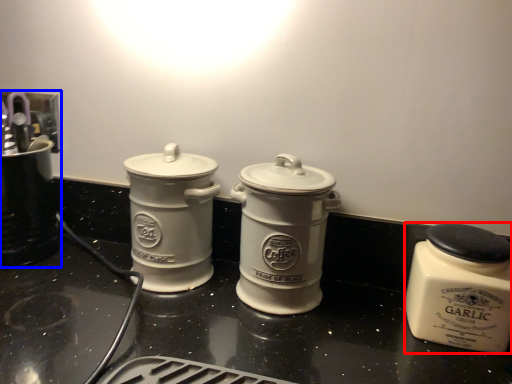
Question: Which object is closer to the camera taking this photo, kitchen appliance (highlighted by a red box) or appliance (highlighted by a blue box)?

Choices:
 (A) kitchen appliance
 (B) appliance

Answer: (A)